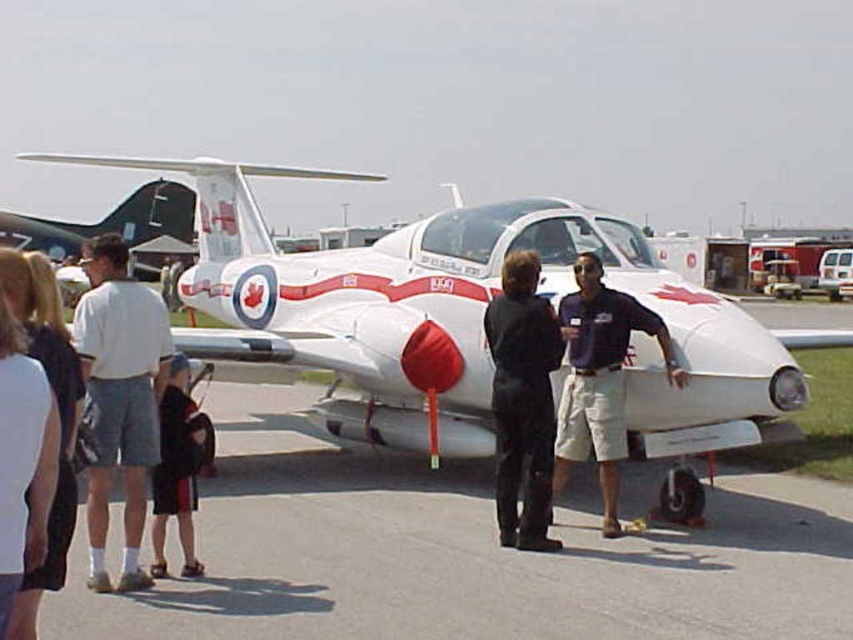
Question: Which of the following is the closest to the observer?

Choices:
 (A) gray asphalt tarmac at center
 (B) white cotton shirt at left

Answer: (B)

Question: Does black leather pants at center appear under white cotton shirt at left?

Choices:
 (A) yes
 (B) no

Answer: (A)

Question: Is white cotton shorts at left in front of white cotton shirt at left?

Choices:
 (A) yes
 (B) no

Answer: (B)

Question: Can you confirm if white cotton shorts at left is smaller than dark blue shirt at center?

Choices:
 (A) yes
 (B) no

Answer: (B)

Question: Which of the following is the closest to the observer?

Choices:
 (A) (538, 538)
 (B) (25, 253)

Answer: (B)

Question: Considering the real-world distances, which object is closest to the white cotton shorts at left?

Choices:
 (A) white matte airplane at center
 (B) dark blue shirt at center

Answer: (B)